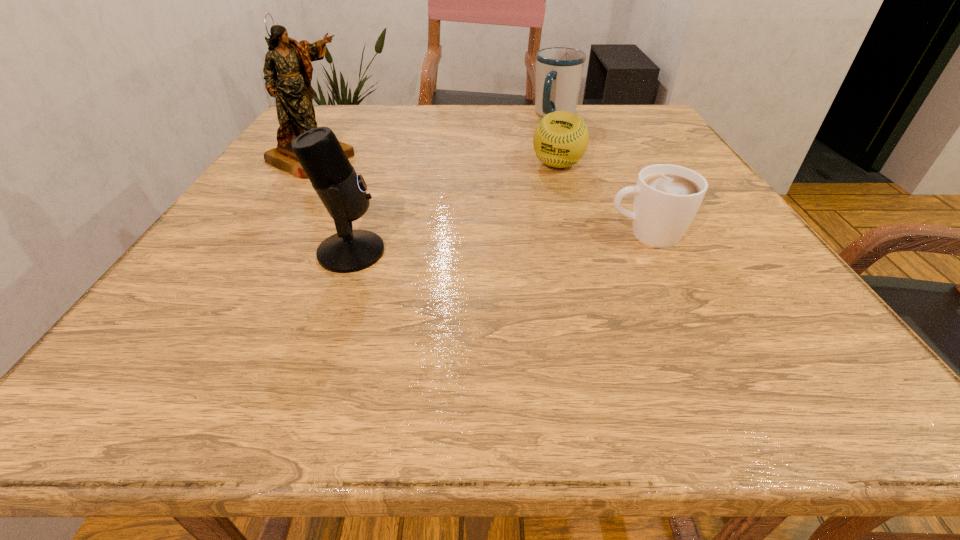
Locate an element on the screen. This screenshot has height=540, width=960. free space on the desktop that is between the microphone and the cappuccino and is positioned on the front-facing side of the figurine is located at coordinates (493, 244).

Identify the location of free spot on the desktop that is between the fourth object from right to left and the cappuccino and is positioned on the logo side of the softball. (523, 241).

You are a GUI agent. You are given a task and a screenshot of the screen. Output one action in this format:
    pyautogui.click(x=<x>, y=<y>)
    Task: Click on the vacant space on the desktop that is between the microphone and the cappuccino and is positioned on the handle side of the mug
    The height and width of the screenshot is (540, 960).
    Given the screenshot: What is the action you would take?
    pos(487,244)